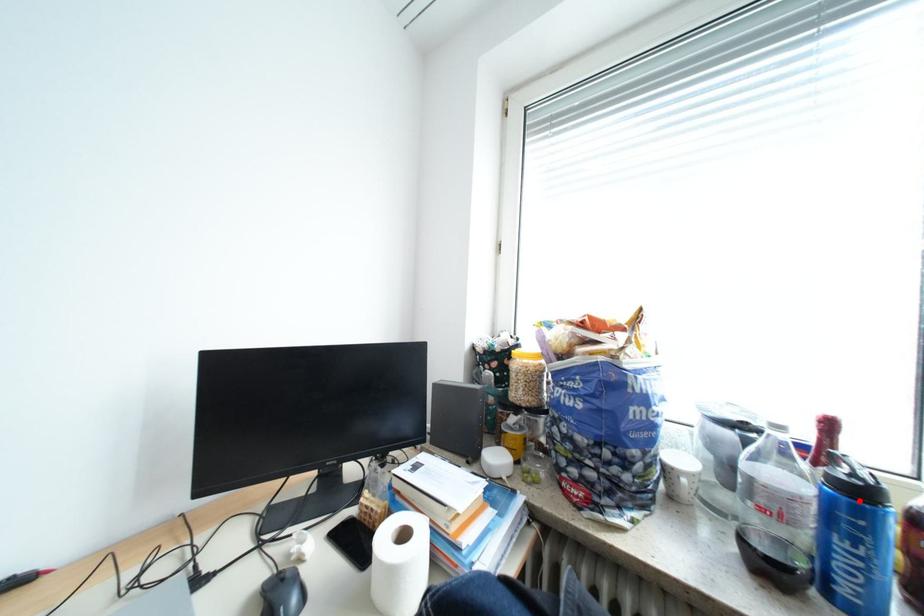
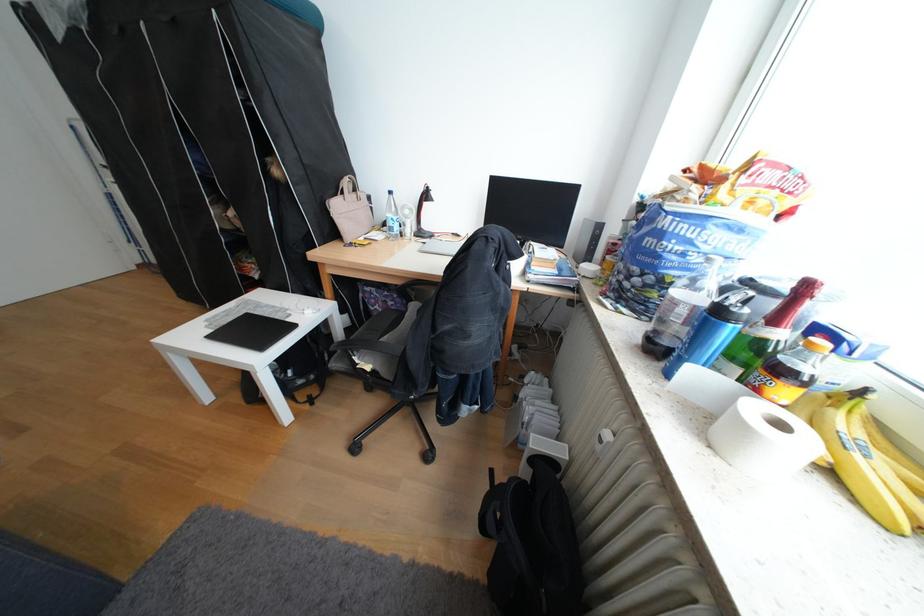
Where in the second image is the point corresponding to the highlighted location from the first image?

(719, 314)